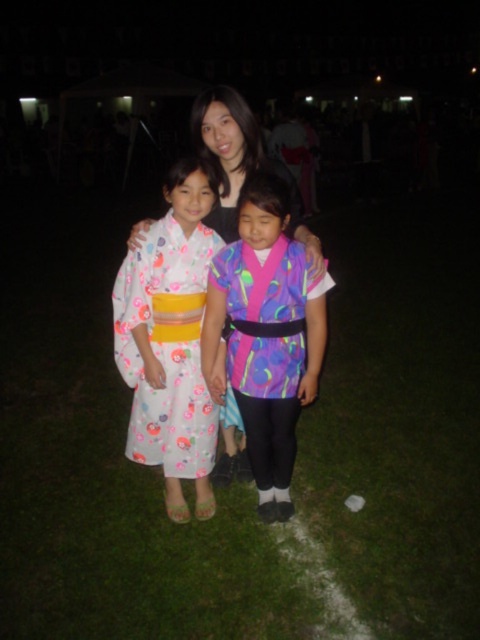
You are standing at the edge of the grassy area and want to place a small picnic basket exactly where the green grass at center is located. What are the coordinates where you should place it?

The coordinates for the green grass at center are point (x=105, y=467).